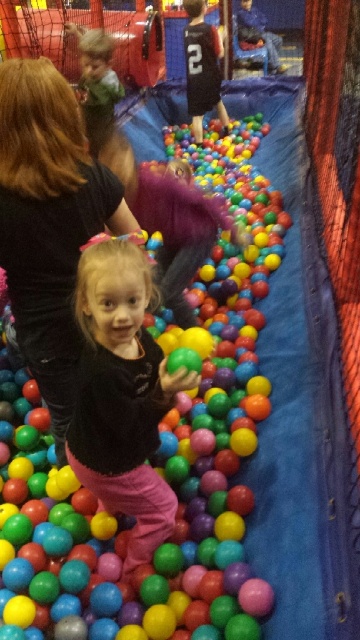
Is point (33, 636) in front of point (118, 308)?

No.

Is matte plastic ball at center positioned behind matte black shirt at center?

Yes, matte plastic ball at center is further from the viewer.

Locate an element on the screen. Image resolution: width=360 pixels, height=640 pixels. matte plastic ball at center is located at coordinates (156, 451).

Which is below, matte black shirt at center or matte green shirt at upper left?

matte black shirt at center is below.

Between matte black shirt at center and matte green shirt at upper left, which one appears on the right side from the viewer's perspective?

matte black shirt at center is more to the right.

Does point (87, 467) come in front of point (97, 65)?

Yes.

Identify the location of matte black shirt at center. The width and height of the screenshot is (360, 640). (122, 394).

You are a GUI agent. You are given a task and a screenshot of the screen. Output one action in this format:
    pyautogui.click(x=<x>, y=<y>)
    Task: Click on the black fabric at upper left
    
    Given the screenshot: What is the action you would take?
    pyautogui.click(x=48, y=221)

Does black fabric at upper left have a larger size compared to matte black shirt at center?

Indeed, black fabric at upper left has a larger size compared to matte black shirt at center.

Who is more forward, (16,163) or (78,394)?

Positioned in front is point (16,163).

At what (x,y) coordinates should I click in order to perform the action: click on black fabric at upper left. Please return your answer as a coordinate pair (x, y). The image size is (360, 640). Looking at the image, I should click on (48, 221).